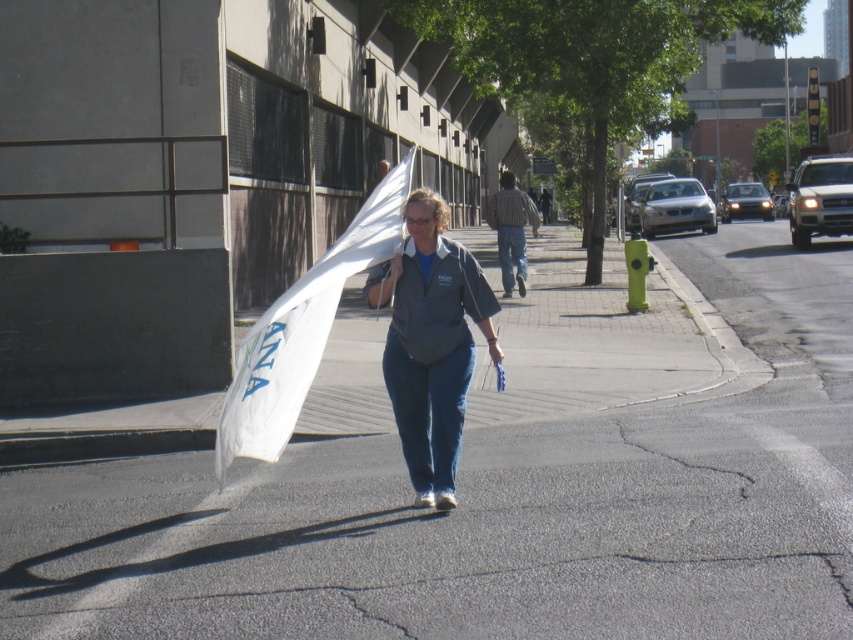
Question: Which object is closer to the camera taking this photo?

Choices:
 (A) asphalt at center
 (B) matte gray shirt at center

Answer: (A)

Question: Which object is closer to the camera taking this photo?

Choices:
 (A) asphalt at center
 (B) matte gray shirt at center

Answer: (A)

Question: In this image, where is asphalt at center located relative to matte gray shirt at center?

Choices:
 (A) below
 (B) above

Answer: (A)

Question: Is asphalt at center wider than matte gray shirt at center?

Choices:
 (A) yes
 (B) no

Answer: (A)

Question: Can you confirm if asphalt at center is smaller than matte gray shirt at center?

Choices:
 (A) no
 (B) yes

Answer: (A)